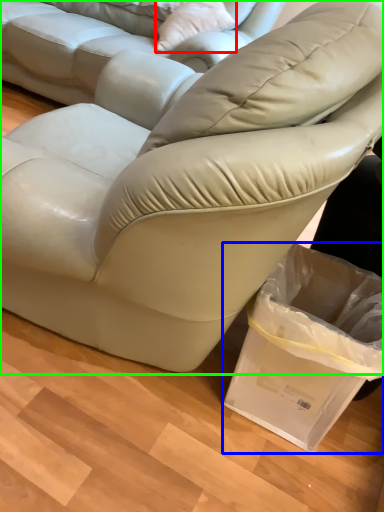
Question: Which object is positioned closest to throw pillow (highlighted by a red box)? Select from shopping bag (highlighted by a blue box) and studio couch (highlighted by a green box).

Choices:
 (A) shopping bag
 (B) studio couch

Answer: (B)